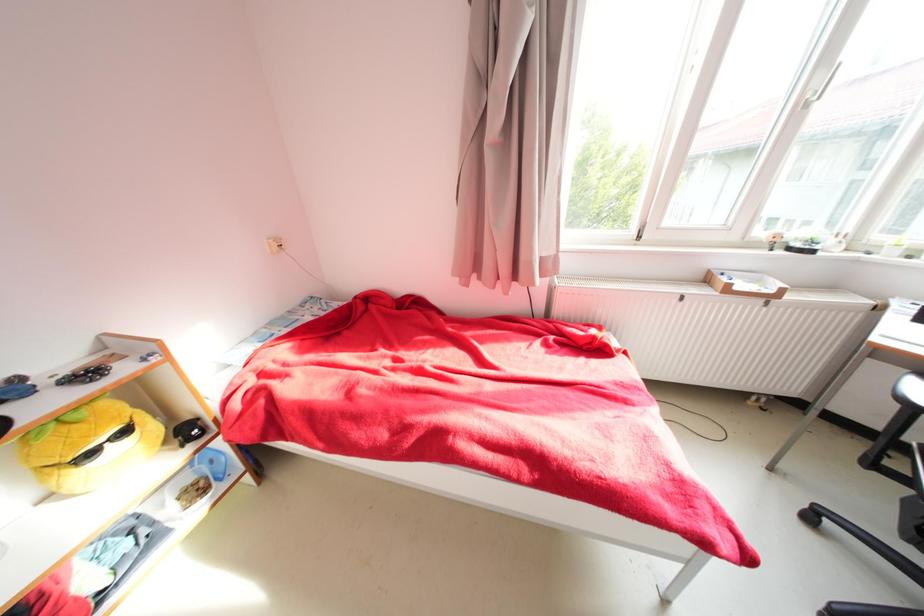
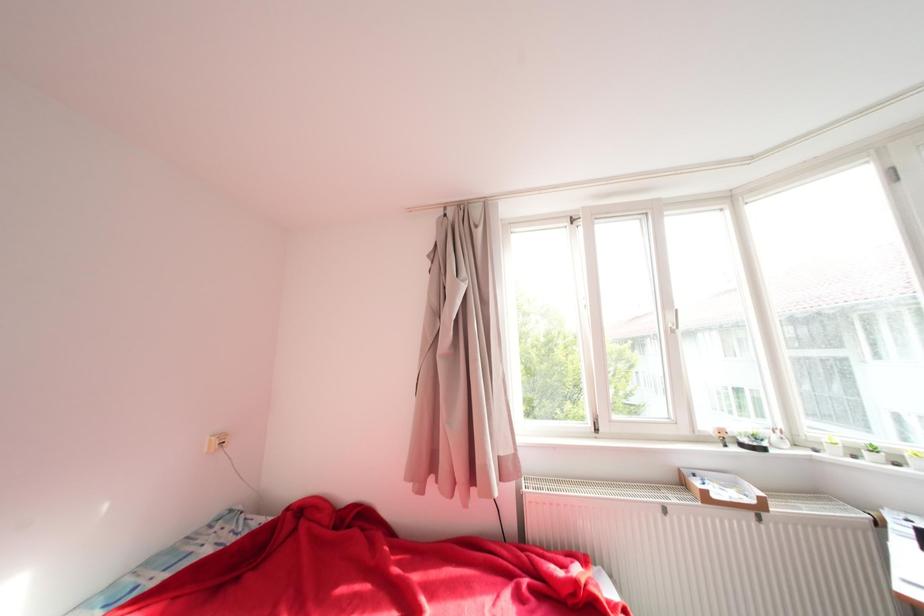
Question: The first image is from the beginning of the video and the second image is from the end. How did the camera likely rotate when shooting the video?

Choices:
 (A) Left
 (B) Right
 (C) Up
 (D) Down

Answer: (C)